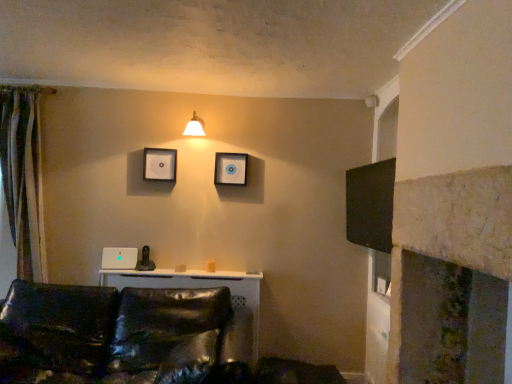
Question: Which direction should I rotate to look at white glossy picture frame at upper center, the first picture frame from the right?

Choices:
 (A) left
 (B) right

Answer: (A)

Question: From a real-world perspective, is white glossy wall sconce at upper center located higher than white matte picture frame at upper center, arranged as the second picture frame when viewed from the right?

Choices:
 (A) yes
 (B) no

Answer: (A)

Question: Can you confirm if white glossy wall sconce at upper center is bigger than white matte picture frame at upper center, arranged as the second picture frame when viewed from the right?

Choices:
 (A) yes
 (B) no

Answer: (A)

Question: From the image's perspective, is white glossy wall sconce at upper center above white matte picture frame at upper center, arranged as the second picture frame when viewed from the right?

Choices:
 (A) yes
 (B) no

Answer: (A)

Question: Could white matte picture frame at upper center, the first picture frame from the left, be considered to be inside white glossy wall sconce at upper center?

Choices:
 (A) yes
 (B) no

Answer: (B)

Question: Is white glossy wall sconce at upper center further to camera compared to white matte picture frame at upper center, the first picture frame from the left?

Choices:
 (A) yes
 (B) no

Answer: (B)

Question: From the image's perspective, is white glossy wall sconce at upper center located beneath white matte picture frame at upper center, arranged as the second picture frame when viewed from the right?

Choices:
 (A) no
 (B) yes

Answer: (A)

Question: Is white matte picture frame at upper center, the first picture frame from the left, turned away from white glossy wall sconce at upper center?

Choices:
 (A) yes
 (B) no

Answer: (B)

Question: Is white matte picture frame at upper center, arranged as the second picture frame when viewed from the right, bigger than white glossy wall sconce at upper center?

Choices:
 (A) no
 (B) yes

Answer: (A)

Question: Is white glossy wall sconce at upper center completely or partially inside white matte picture frame at upper center, the first picture frame from the left?

Choices:
 (A) no
 (B) yes

Answer: (A)

Question: Does white matte picture frame at upper center, the first picture frame from the left, have a lesser width compared to white glossy wall sconce at upper center?

Choices:
 (A) no
 (B) yes

Answer: (B)

Question: Is white matte picture frame at upper center, the first picture frame from the left, wider than white glossy wall sconce at upper center?

Choices:
 (A) yes
 (B) no

Answer: (B)

Question: Is white matte picture frame at upper center, arranged as the second picture frame when viewed from the right, smaller than white glossy wall sconce at upper center?

Choices:
 (A) yes
 (B) no

Answer: (A)

Question: Considering the relative sizes of white glossy picture frame at upper center, arranged as the second picture frame when viewed from the left, and shiny black leather couch at lower left in the image provided, is white glossy picture frame at upper center, arranged as the second picture frame when viewed from the left, wider than shiny black leather couch at lower left?

Choices:
 (A) yes
 (B) no

Answer: (B)